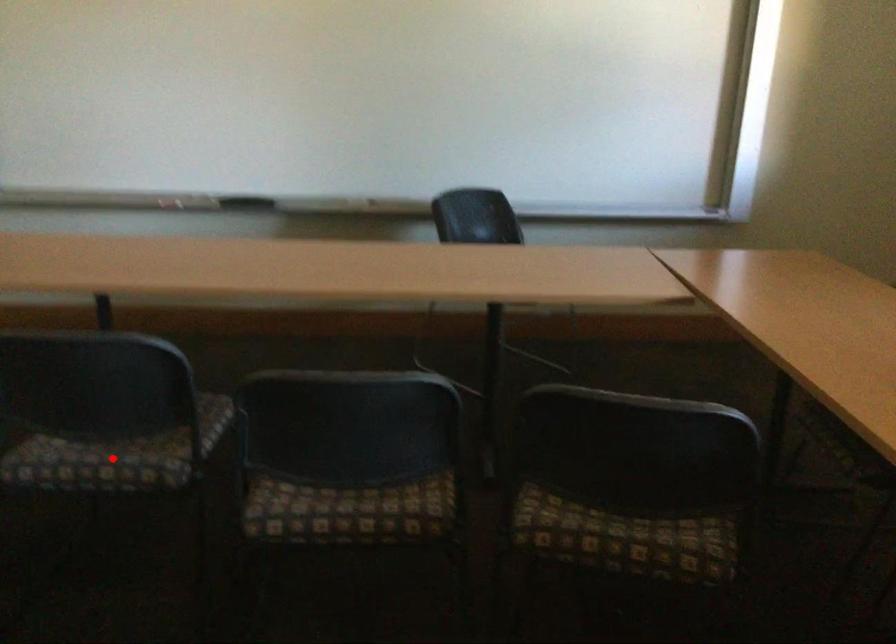
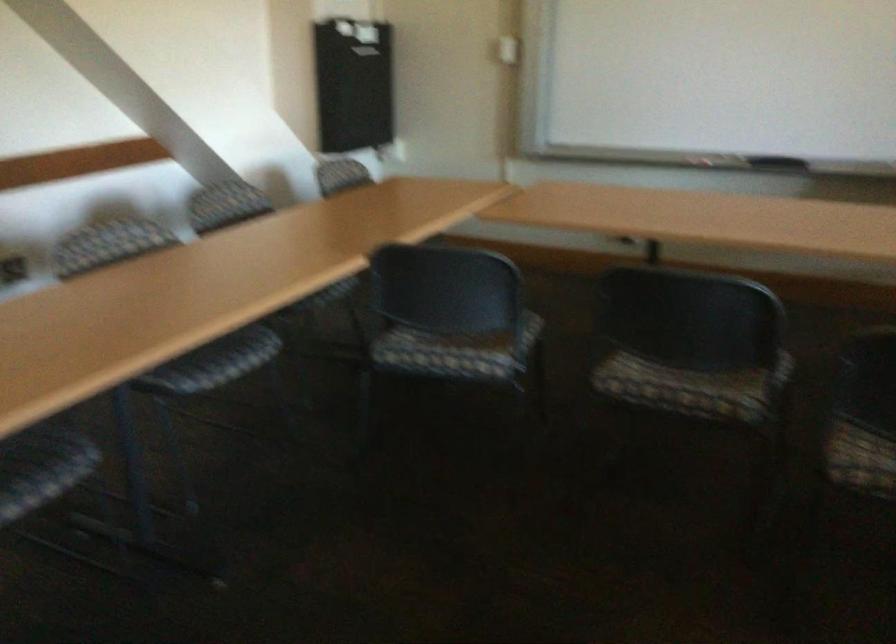
Question: I am providing you with two images of the same scene from different viewpoints. Image1 has a red point marked. In image2, the corresponding 3D location appears at what relative position? Reply with the corresponding letter.

Choices:
 (A) Closer
 (B) Farther

Answer: (B)